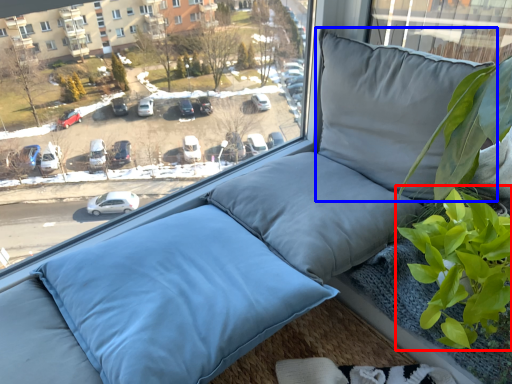
Question: Which point is further to the camera, vegetation (highlighted by a red box) or pillow (highlighted by a blue box)?

Choices:
 (A) vegetation
 (B) pillow

Answer: (B)